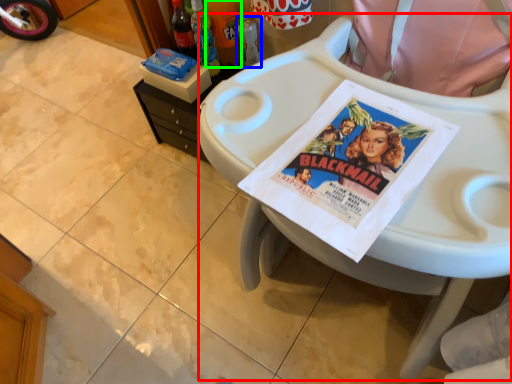
Question: Which object is the closest to the feeding chair (highlighted by a red box)? Choose among these: bottle (highlighted by a blue box) or bottle (highlighted by a green box).

Choices:
 (A) bottle
 (B) bottle

Answer: (A)